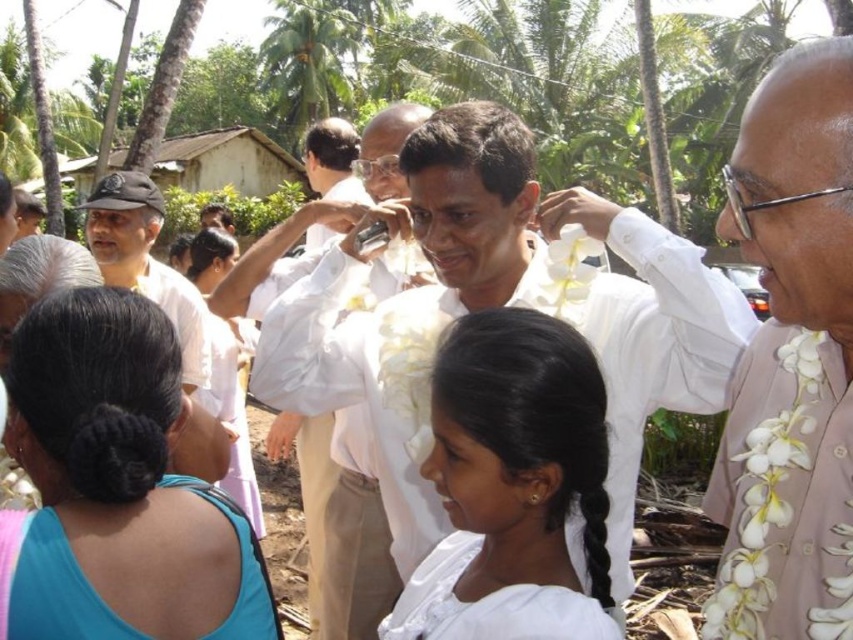
Question: Estimate the real-world distances between objects in this image. Which object is closer to the white fabric at center?

Choices:
 (A) light brown textured shirt at right
 (B) white cloth shirt at center
 (C) blue fabric hair tie at upper left

Answer: (A)

Question: Estimate the real-world distances between objects in this image. Which object is closer to the light brown textured shirt at right?

Choices:
 (A) blue fabric hair tie at upper left
 (B) white fabric at center
 (C) white cloth shirt at center

Answer: (B)

Question: Among these objects, which one is nearest to the camera?

Choices:
 (A) light brown textured shirt at right
 (B) white fabric at center
 (C) blue fabric hair tie at upper left
 (D) white cloth shirt at center

Answer: (A)

Question: Is light brown textured shirt at right positioned in front of white fabric at center?

Choices:
 (A) no
 (B) yes

Answer: (B)

Question: Observing the image, what is the correct spatial positioning of light brown textured shirt at right in reference to blue fabric hair tie at upper left?

Choices:
 (A) below
 (B) above

Answer: (B)

Question: Does white fabric at center come behind white cloth shirt at center?

Choices:
 (A) yes
 (B) no

Answer: (B)